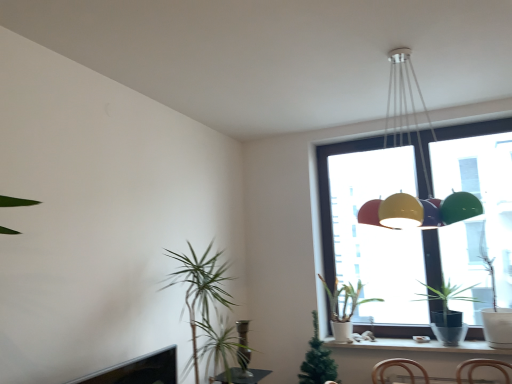
Question: Would you say white matte pot at window, the 2th houseplant from the left, is outside white ceramic window sill at lower right?

Choices:
 (A) yes
 (B) no

Answer: (A)

Question: Is white matte pot at window, the 2th houseplant from the left, shorter than white ceramic window sill at lower right?

Choices:
 (A) no
 (B) yes

Answer: (A)

Question: From the image's perspective, is white matte pot at window, the 2th houseplant from the left, on white ceramic window sill at lower right?

Choices:
 (A) no
 (B) yes

Answer: (B)

Question: Is white matte pot at window, the 2th houseplant from the left, far away from white ceramic window sill at lower right?

Choices:
 (A) no
 (B) yes

Answer: (A)

Question: Is white matte pot at window, which is the second houseplant in right-to-left order, in contact with white ceramic window sill at lower right?

Choices:
 (A) no
 (B) yes

Answer: (A)

Question: Can you confirm if white matte pot at window, the 2th houseplant from the left, is wider than white ceramic window sill at lower right?

Choices:
 (A) no
 (B) yes

Answer: (B)

Question: Is metallic pendant light at upper center at the left side of white ceramic window sill at lower right?

Choices:
 (A) yes
 (B) no

Answer: (A)

Question: Could you tell me if metallic pendant light at upper center is facing white ceramic window sill at lower right?

Choices:
 (A) yes
 (B) no

Answer: (B)

Question: Is metallic pendant light at upper center positioned far away from white ceramic window sill at lower right?

Choices:
 (A) no
 (B) yes

Answer: (B)

Question: Would you say metallic pendant light at upper center is outside white ceramic window sill at lower right?

Choices:
 (A) no
 (B) yes

Answer: (B)

Question: From a real-world perspective, is metallic pendant light at upper center under white ceramic window sill at lower right?

Choices:
 (A) yes
 (B) no

Answer: (B)

Question: From the image's perspective, does metallic pendant light at upper center appear lower than white ceramic window sill at lower right?

Choices:
 (A) yes
 (B) no

Answer: (B)

Question: Is white ceramic window sill at lower right closer to camera compared to transparent glass window at upper right?

Choices:
 (A) no
 (B) yes

Answer: (B)